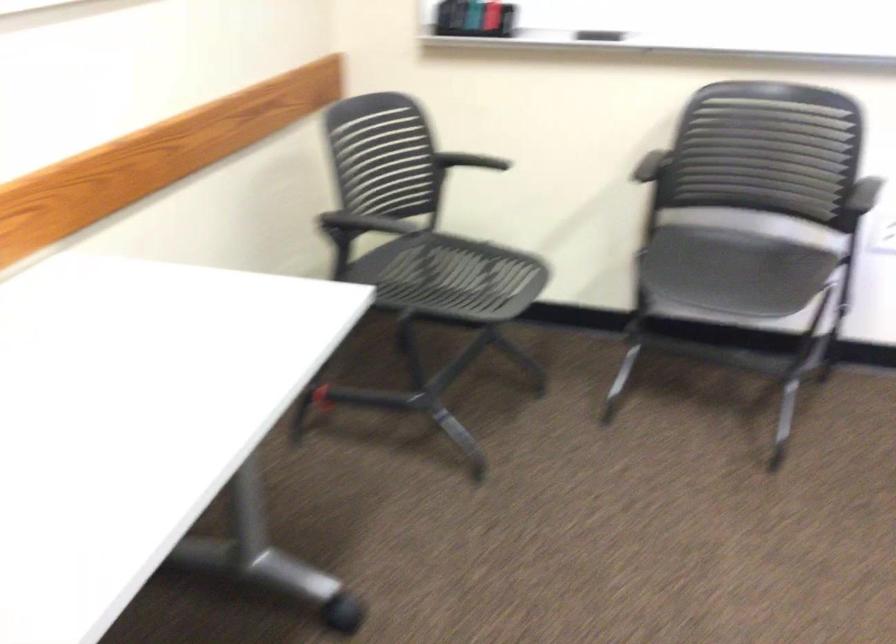
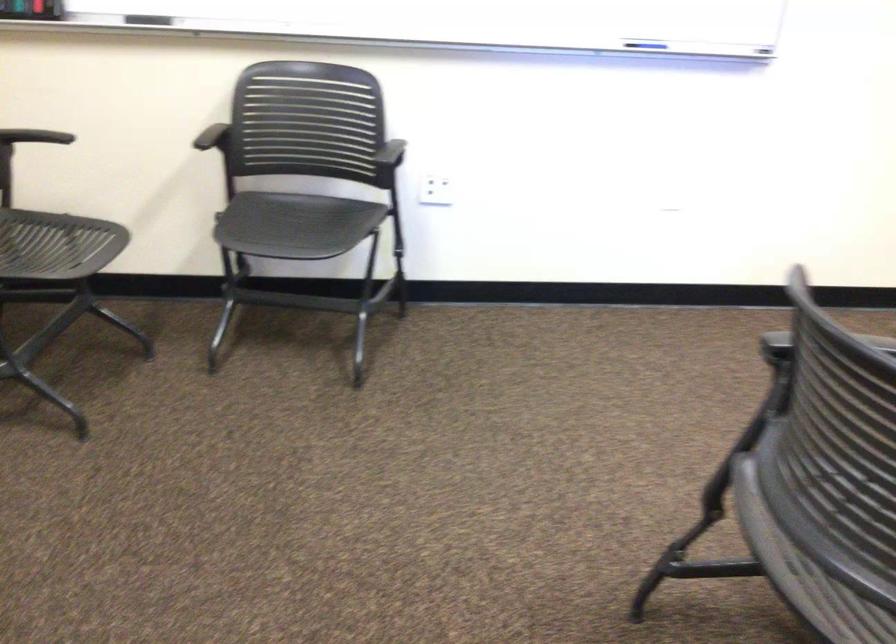
In the second image, find the point that corresponds to point 477,281 in the first image.

(56, 245)